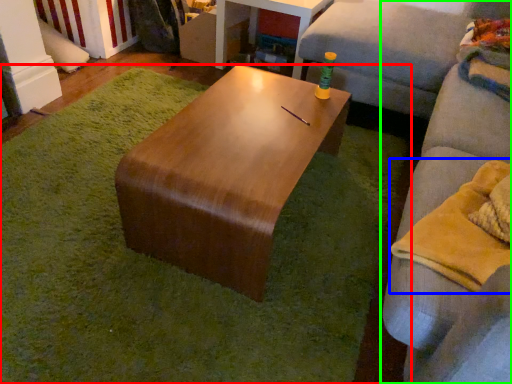
Question: Estimate the real-world distances between objects in this image. Which object is farther from mat (highlighted by a red box), material (highlighted by a blue box) or studio couch (highlighted by a green box)?

Choices:
 (A) material
 (B) studio couch

Answer: (B)